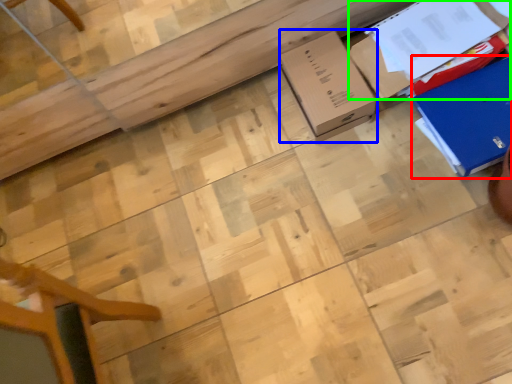
Question: Which object is positioned farthest from cardboard box (highlighted by a red box)? Select from cardboard box (highlighted by a blue box) and cardboard box (highlighted by a green box).

Choices:
 (A) cardboard box
 (B) cardboard box

Answer: (A)